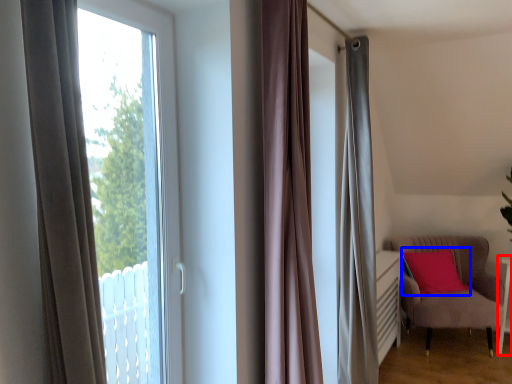
Question: Which point is closer to the camera, side table (highlighted by a red box) or pillow (highlighted by a blue box)?

Choices:
 (A) side table
 (B) pillow

Answer: (A)